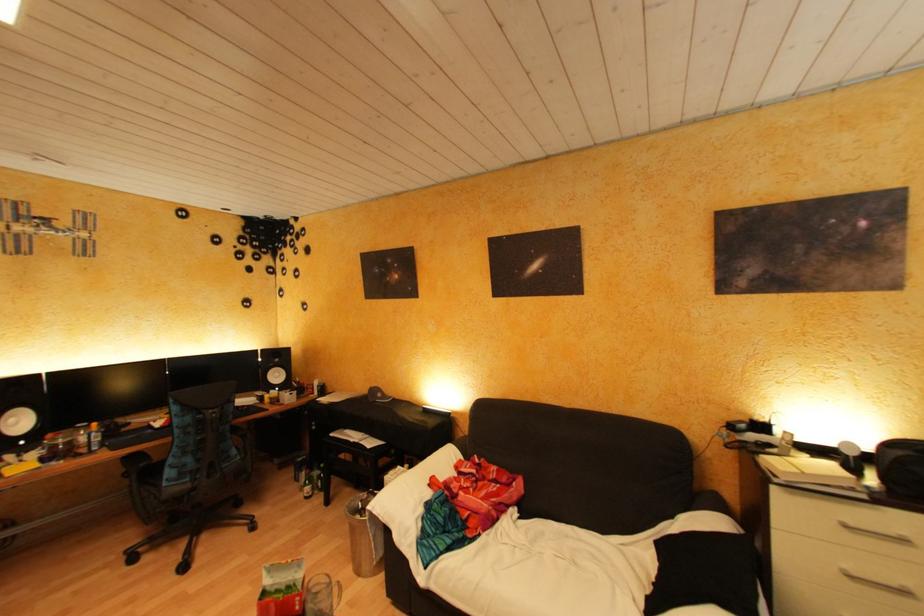
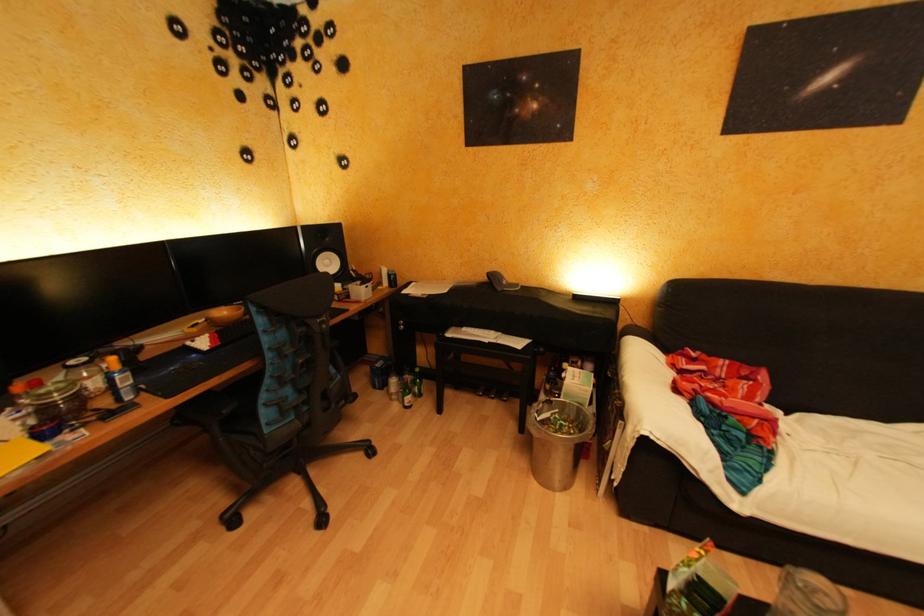
The images are taken continuously from a first-person perspective. In which direction are you moving?

The cameraman walked toward left, forward.